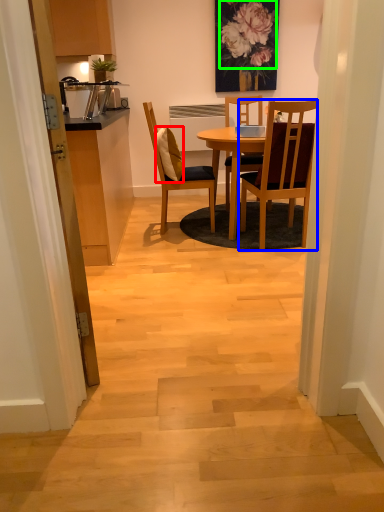
Question: Which object is the closest to the pillow (highlighted by a red box)? Choose among these: chair (highlighted by a blue box) or flower (highlighted by a green box).

Choices:
 (A) chair
 (B) flower

Answer: (A)